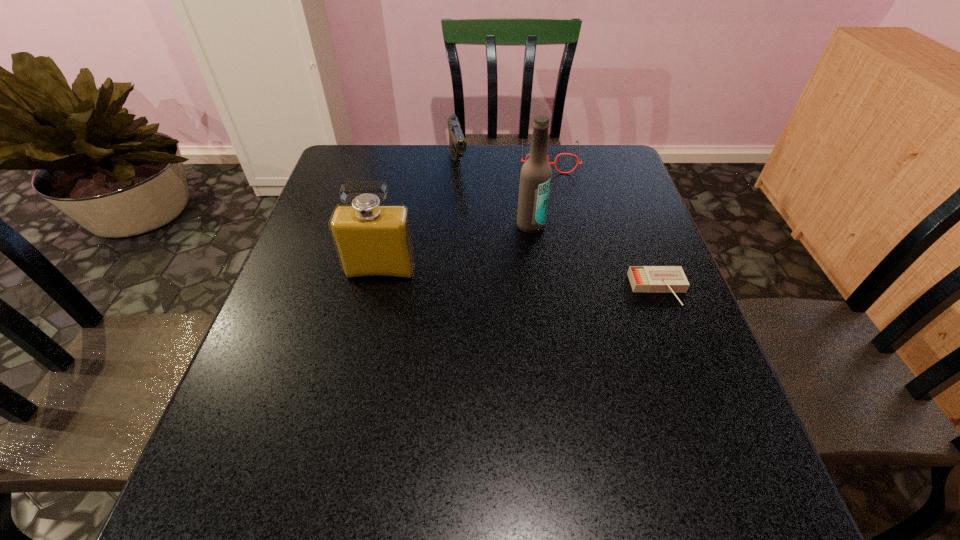
What are the coordinates of `the second tallest object` in the screenshot? It's located at (373, 241).

Locate an element on the screen. The image size is (960, 540). the leftmost object is located at coordinates (373, 241).

Find the location of `the rightmost object`. the rightmost object is located at coordinates (642, 278).

Identify the location of matchbox. This screenshot has width=960, height=540. (642, 278).

I want to click on pistol, so click(457, 144).

Image resolution: width=960 pixels, height=540 pixels. Find the location of `the third tallest object`. the third tallest object is located at coordinates (457, 144).

Where is `beer bottle`? The width and height of the screenshot is (960, 540). beer bottle is located at coordinates tap(535, 177).

What are the coordinates of `the tallest object` in the screenshot? It's located at (535, 177).

In order to click on the fourth tallest object in this screenshot , I will do `click(554, 163)`.

You are a GUI agent. You are given a task and a screenshot of the screen. Output one action in this format:
    pyautogui.click(x=<x>, y=<y>)
    Task: Click on the vacant space located 0.360m on the front-facing side of the second tallest object
    This screenshot has width=960, height=540.
    Given the screenshot: What is the action you would take?
    pyautogui.click(x=347, y=429)